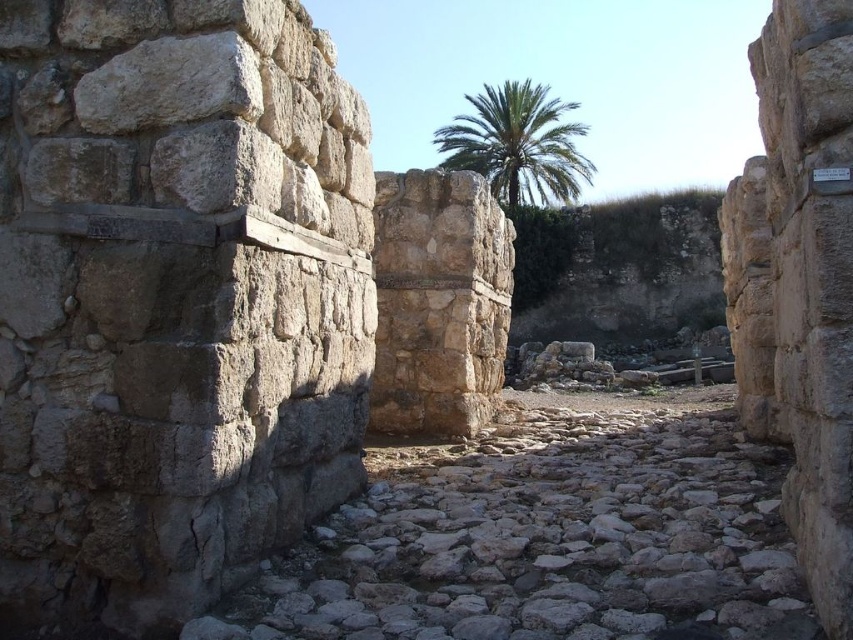
Does yellowish stone wall at center have a larger size compared to white plastic sign at upper right?

Yes, yellowish stone wall at center is bigger than white plastic sign at upper right.

Which of these two, yellowish stone wall at center or white plastic sign at upper right, stands taller?

yellowish stone wall at center

Between point (831, 124) and point (817, 180), which one is positioned behind?

Point (817, 180)

Image resolution: width=853 pixels, height=640 pixels. Identify the location of yellowish stone wall at center. (799, 284).

Which of these two, gray stone wall at center or yellowish stone wall at center, stands shorter?

Standing shorter between the two is gray stone wall at center.

Is point (229, 416) farther from camera compared to point (802, 129)?

Yes.

Find the location of a particular element. gray stone wall at center is located at coordinates (173, 300).

Measure the distance between gray stone wall at center and white plastic sign at upper right.

The distance of gray stone wall at center from white plastic sign at upper right is 21.21 feet.

Looking at this image, who is more forward, [247,17] or [817,179]?

Point [817,179] is in front.

Is point (299, 10) more distant than point (815, 170)?

Yes, point (299, 10) is farther from viewer.

Locate an element on the screen. gray stone wall at center is located at coordinates (173, 300).